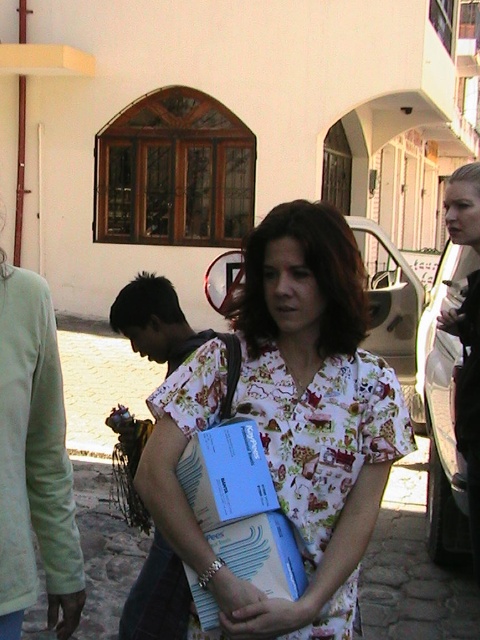
Question: Can you confirm if floral fabric dress at center is positioned to the left of floral fabric shirt at center?

Choices:
 (A) yes
 (B) no

Answer: (B)

Question: Does floral fabric dress at center appear on the right side of floral fabric shirt at center?

Choices:
 (A) yes
 (B) no

Answer: (A)

Question: Is floral fabric dress at center above floral fabric shirt at center?

Choices:
 (A) yes
 (B) no

Answer: (A)